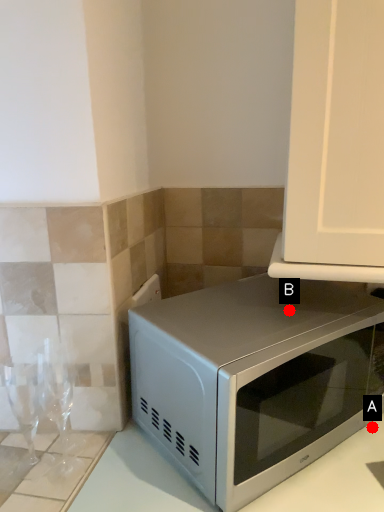
Question: Two points are circled on the image, labeled by A and B beside each circle. Which point is closer to the camera taking this photo?

Choices:
 (A) A is closer
 (B) B is closer

Answer: (B)